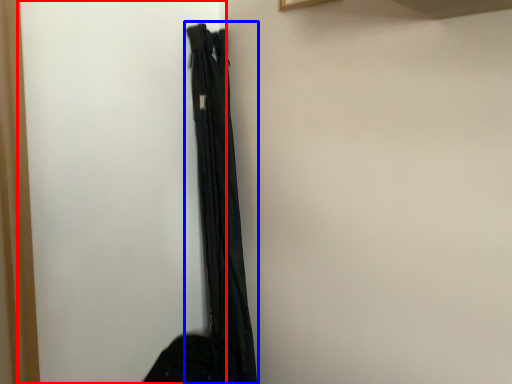
Question: Which of the following is the farthest to the observer, screen door (highlighted by a red box) or curtain (highlighted by a blue box)?

Choices:
 (A) screen door
 (B) curtain

Answer: (B)